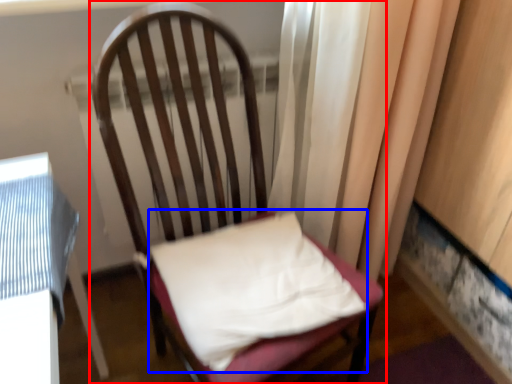
Question: Which object is closer to the camera taking this photo, chair (highlighted by a red box) or pillow (highlighted by a blue box)?

Choices:
 (A) chair
 (B) pillow

Answer: (A)